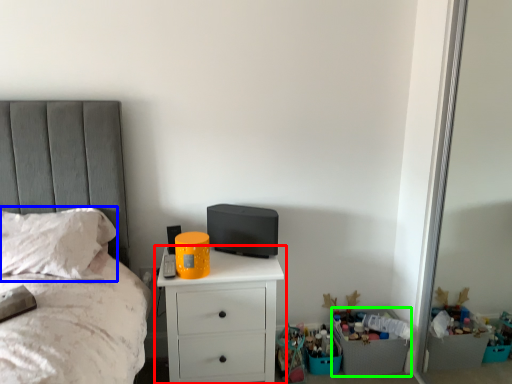
Question: Estimate the real-world distances between objects in this image. Which object is closer to chest of drawers (highlighted by a red box), pillow (highlighted by a blue box) or crate (highlighted by a green box)?

Choices:
 (A) pillow
 (B) crate

Answer: (A)